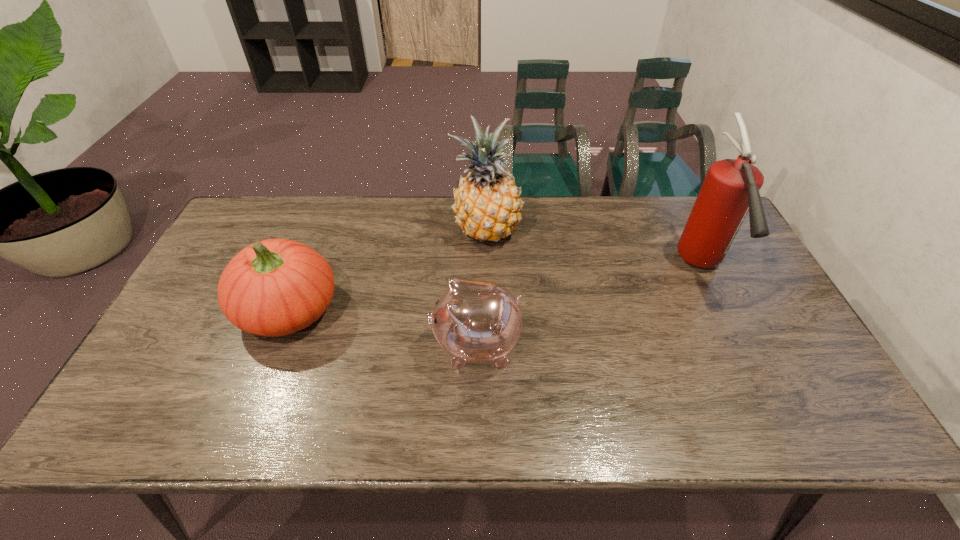
Locate an element on the screen. the rightmost object is located at coordinates (730, 190).

In order to click on the third shortest object in this screenshot , I will do `click(487, 204)`.

Where is `the second shortest object`? This screenshot has height=540, width=960. the second shortest object is located at coordinates (276, 287).

Image resolution: width=960 pixels, height=540 pixels. I want to click on the leftmost object, so click(276, 287).

Image resolution: width=960 pixels, height=540 pixels. Find the location of `the shortest object`. the shortest object is located at coordinates (474, 321).

Identify the location of vacant space located at the nozzle of the fire extinguisher. Image resolution: width=960 pixels, height=540 pixels. (x=756, y=378).

Image resolution: width=960 pixels, height=540 pixels. What are the coordinates of `blank space located on the right of the second tallest object` in the screenshot? It's located at (594, 232).

The image size is (960, 540). I want to click on free region located on the right of the third tallest object, so click(x=384, y=309).

You are a GUI agent. You are given a task and a screenshot of the screen. Output one action in this format:
    pyautogui.click(x=<x>, y=<y>)
    Task: Click on the free region located on the front facing side of the piggy bank
    This screenshot has width=960, height=540.
    Given the screenshot: What is the action you would take?
    pyautogui.click(x=321, y=345)

Identify the location of vacant area situated 0.240m on the front facing side of the piggy bank. This screenshot has height=540, width=960. (336, 345).